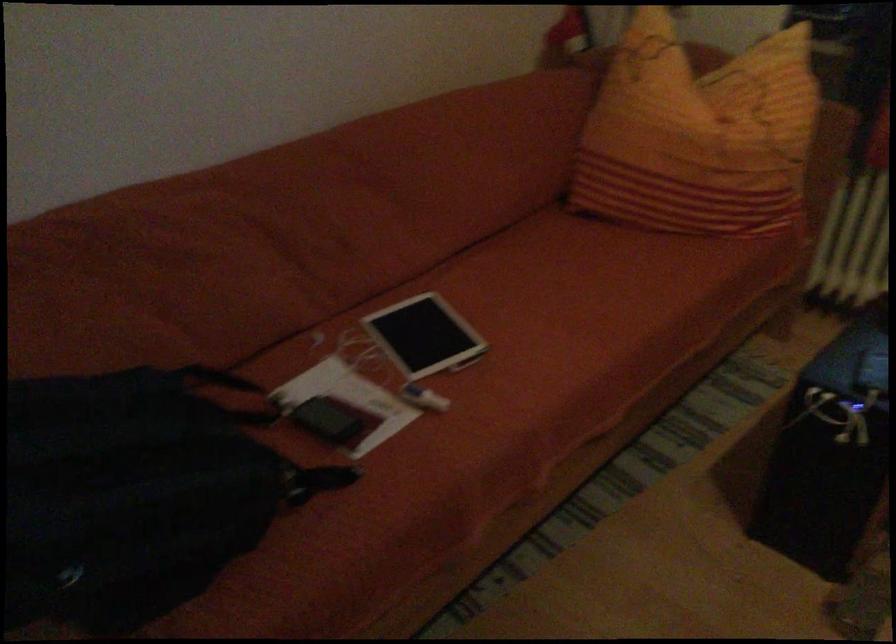
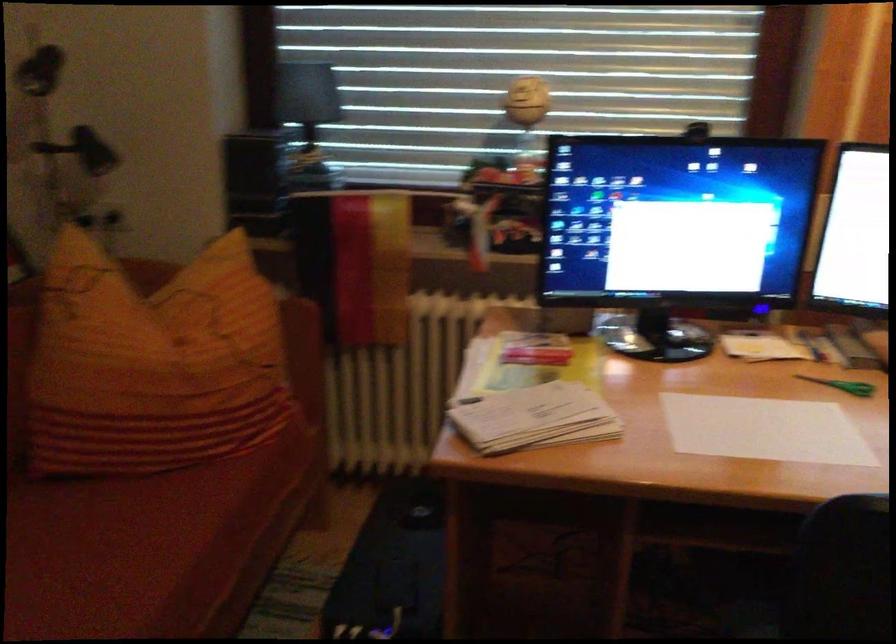
Question: The camera is either moving clockwise (left) or counter-clockwise (right) around the object. The first image is from the beginning of the video and the second image is from the end. Is the camera moving left or right when shooting the video?

Choices:
 (A) Left
 (B) Right

Answer: (A)